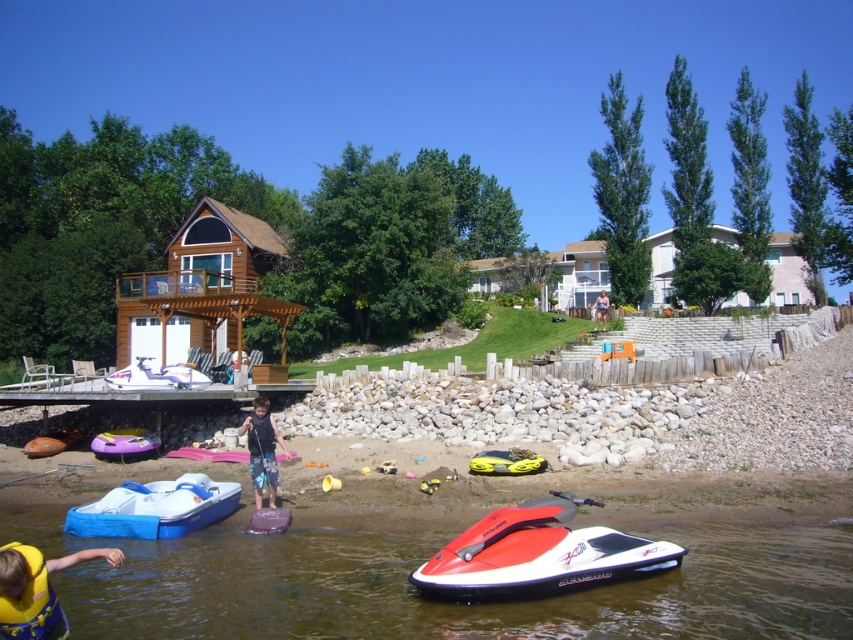
Question: Is red glossy jet ski at lower center bigger than rubber/soft tube at lower left?

Choices:
 (A) no
 (B) yes

Answer: (B)

Question: Which point is farther to the camera?

Choices:
 (A) (90, 536)
 (B) (474, 461)
 (C) (126, 444)

Answer: (C)

Question: Among these objects, which one is farthest from the camera?

Choices:
 (A) smooth water at lower center
 (B) yellow rubber boat at lower center
 (C) white matte pedal boat at lower left
 (D) matte purple kayak at lower center

Answer: (C)

Question: Is rubber/soft tube at lower left bigger than matte purple kayak at lower center?

Choices:
 (A) no
 (B) yes

Answer: (B)

Question: Does blue denim shorts at center have a smaller size compared to white matte pedal boat at lower left?

Choices:
 (A) no
 (B) yes

Answer: (B)

Question: Estimate the real-world distances between objects in this image. Which object is farther from the white matte pedal boat at lower left?

Choices:
 (A) blue denim shorts at center
 (B) matte purple kayak at lower center
 (C) yellow rubber boat at lower center
 (D) blue fabric swimsuit at upper center

Answer: (D)